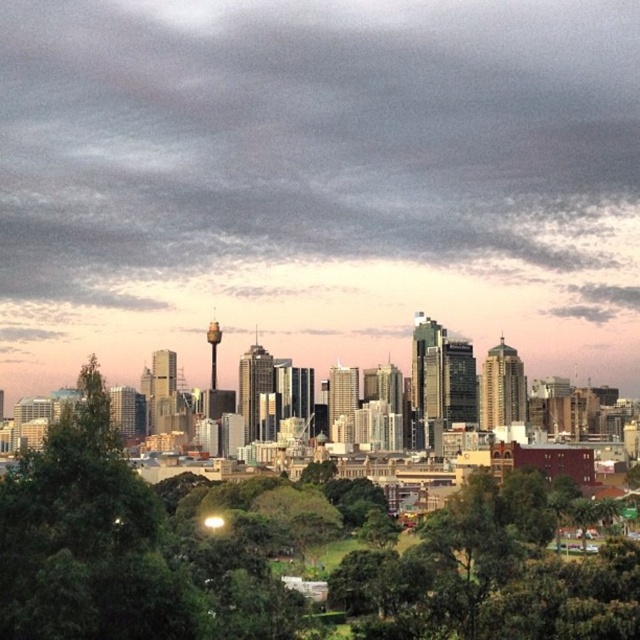
Is point (520, 129) less distant than point (67, 570)?

No, it is not.

Can you confirm if gray/cloudy skyline at upper center is positioned to the right of green leafy tree at center?

In fact, gray/cloudy skyline at upper center is to the left of green leafy tree at center.

Where is `gray/cloudy skyline at upper center`? gray/cloudy skyline at upper center is located at coordinates (317, 154).